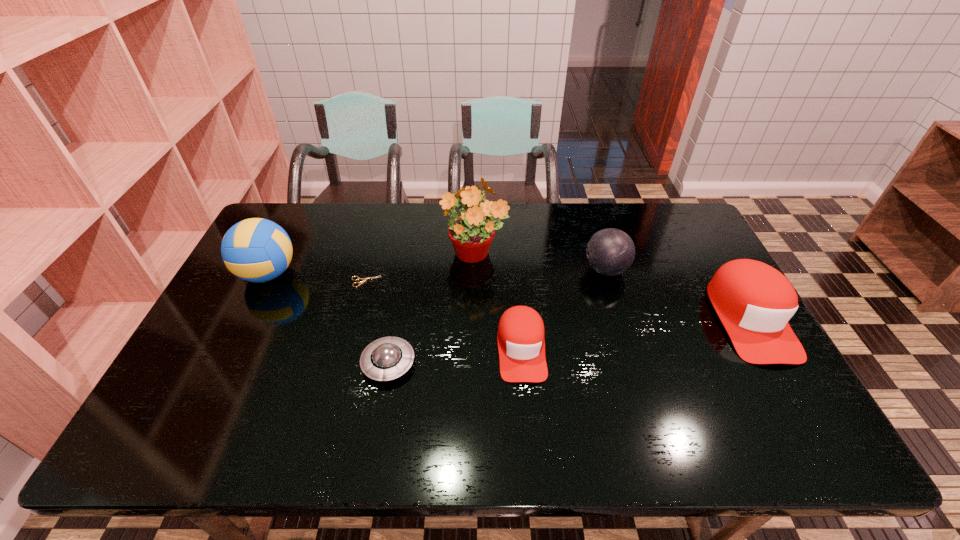
Where is `baseball cap that is at the near edge`? baseball cap that is at the near edge is located at coordinates (521, 345).

Find the location of `saucer present at the near edge`. saucer present at the near edge is located at coordinates (387, 358).

Where is `object that is at the left edge`? The image size is (960, 540). object that is at the left edge is located at coordinates (257, 250).

Identify the location of object located at the right edge. click(754, 301).

Where is `free location at the far edge`? free location at the far edge is located at coordinates (630, 236).

Where is `free spot at the near edge of the desktop`? free spot at the near edge of the desktop is located at coordinates (415, 402).

This screenshot has width=960, height=540. In the image, there is a desktop. What are the coordinates of `free region at the far left corner` in the screenshot? It's located at (x=303, y=213).

In the image, there is a desktop. Where is `vacant space at the far right corner`? The image size is (960, 540). vacant space at the far right corner is located at coordinates [678, 213].

At what (x,y) coordinates should I click in order to perform the action: click on vacant region between the sixth tallest object and the volleyball. Please return your answer as a coordinate pair (x, y). Image resolution: width=960 pixels, height=540 pixels. Looking at the image, I should click on (328, 319).

Identify the location of vacant space that is in between the sixth object from left to right and the right baseball cap. The height and width of the screenshot is (540, 960). tap(678, 294).